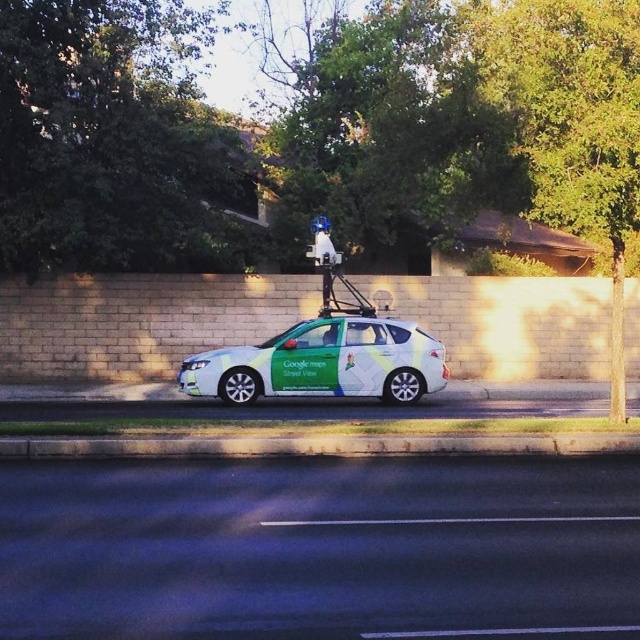
Question: Which point is farther to the camera?

Choices:
 (A) 310,445
 (B) 282,364

Answer: (B)

Question: From the image, what is the correct spatial relationship of green glossy car at center in relation to concrete at lower center?

Choices:
 (A) left
 (B) right

Answer: (A)

Question: Is green glossy car at center to the right of concrete at lower center from the viewer's perspective?

Choices:
 (A) no
 (B) yes

Answer: (A)

Question: Is green glossy car at center bigger than concrete at lower center?

Choices:
 (A) yes
 (B) no

Answer: (A)